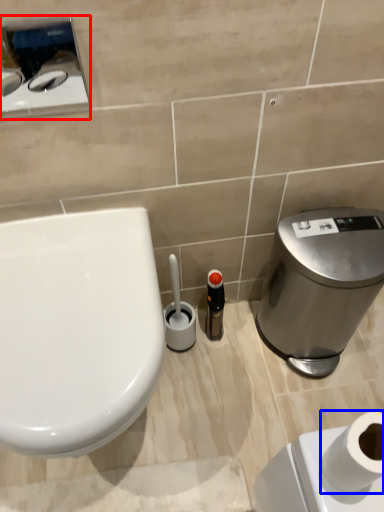
Question: Which of the following is the farthest to the observer, appliance (highlighted by a red box) or toilet paper (highlighted by a blue box)?

Choices:
 (A) appliance
 (B) toilet paper

Answer: (A)